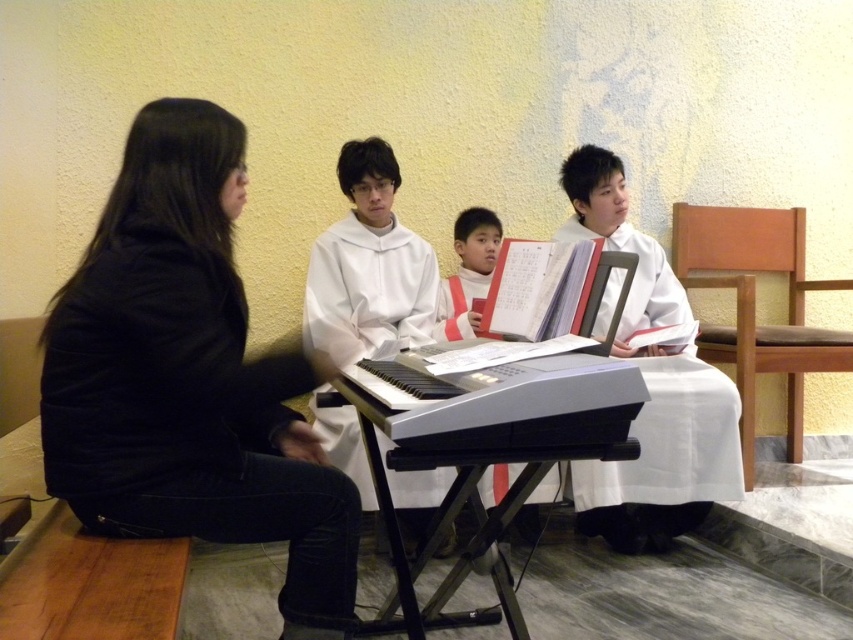
You are a photographer planning to set up a tripod in this church scene. You need to place the tripod between the black fabric chair at left and the white paper at center. Based on their sizes, will the space between them be sufficient for the tripod?

The black fabric chair at left might be wider than white paper at center, so the space between them may not be sufficient for the tripod.

You are a maintenance worker needing to move a 1.5 meter long ladder from the entrance to the storage room. The path requires passing between the black fabric chair at left and the white paper at center. Can the ladder fit through the gap between them?

The distance between the black fabric chair at left and the white paper at center is 1.65 meters. Since the ladder is 1.5 meters long, it can fit through the gap as the space is wider than the ladder.

You are standing at the entrance of the church and see two points marked on the floor. The first point is at coordinate point(3, 374) and the second is at point(677, 227). Which point is closer to you?

Point(3, 374) is closer to you because it is in front of point(677, 227).